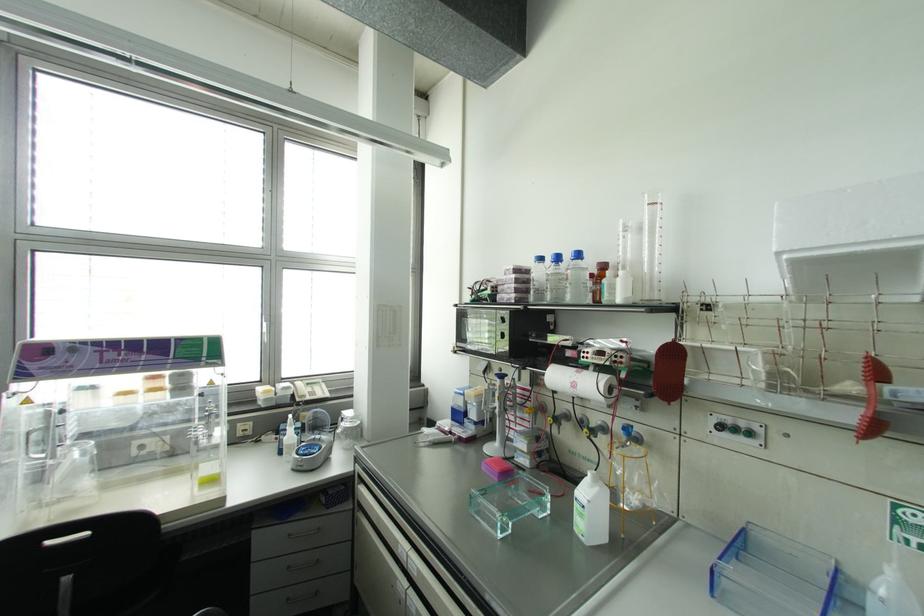
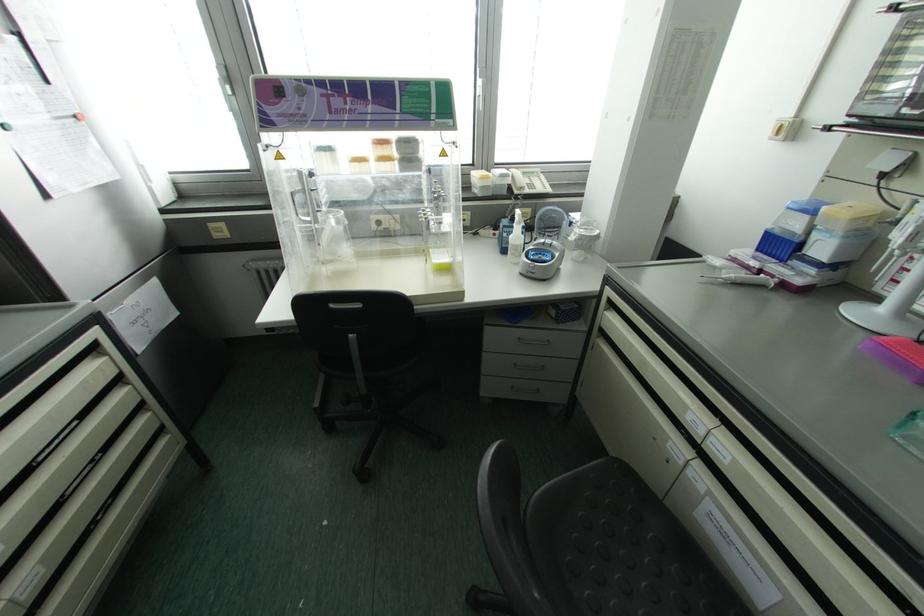
In the second image, find the point that corresponds to point 304,467 in the first image.

(536, 275)